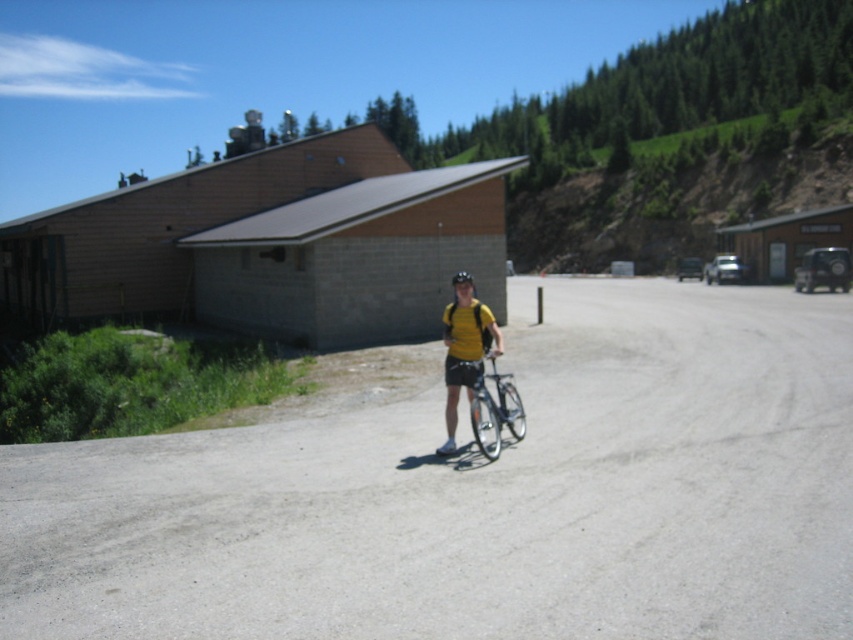
From the picture: You are a photographer trying to capture the yellow matte shirt at center and the black matte bicycle helmet at center in a single photo. Which object should you focus on first to ensure both are in sharp focus?

The yellow matte shirt at center is further to the viewer than the black matte bicycle helmet at center, so you should focus on the yellow matte shirt at center first to ensure both are in sharp focus.

You are standing at the point with coordinates point (489, 436) and want to move towards the camera. Which direction should you go to reach point (9, 477)?

Point (9, 477) is closer to the camera than point (489, 436). To move towards the camera, you should head towards point (9, 477).